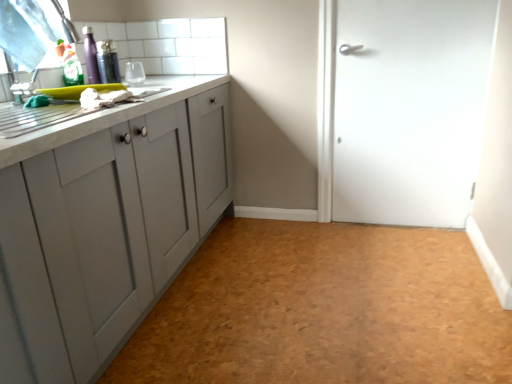
Question: Do you think cork-textured floor at center is within white marble countertop at left, or outside of it?

Choices:
 (A) inside
 (B) outside

Answer: (B)

Question: Based on their positions, is cork-textured floor at center located to the left or right of white marble countertop at left?

Choices:
 (A) left
 (B) right

Answer: (B)

Question: Which is nearer to the cork-textured floor at center?

Choices:
 (A) transparent plastic window screen at upper left
 (B) white marble countertop at left
 (C) white matte door at right
 (D) white tile at upper center

Answer: (C)

Question: Which object is positioned farthest from the transparent plastic window screen at upper left?

Choices:
 (A) white matte door at right
 (B) cork-textured floor at center
 (C) white marble countertop at left
 (D) white tile at upper center

Answer: (A)